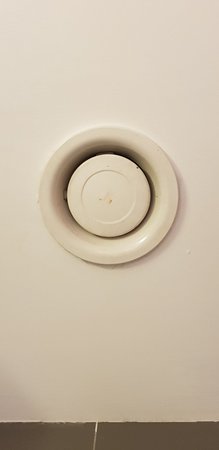
The height and width of the screenshot is (450, 219). In order to click on wall in this screenshot , I will do `click(85, 315)`.